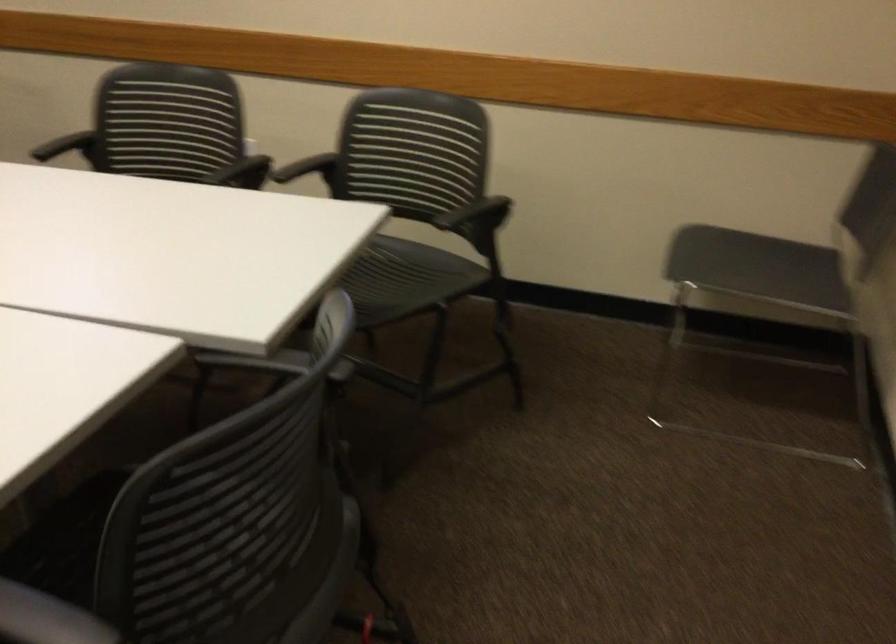
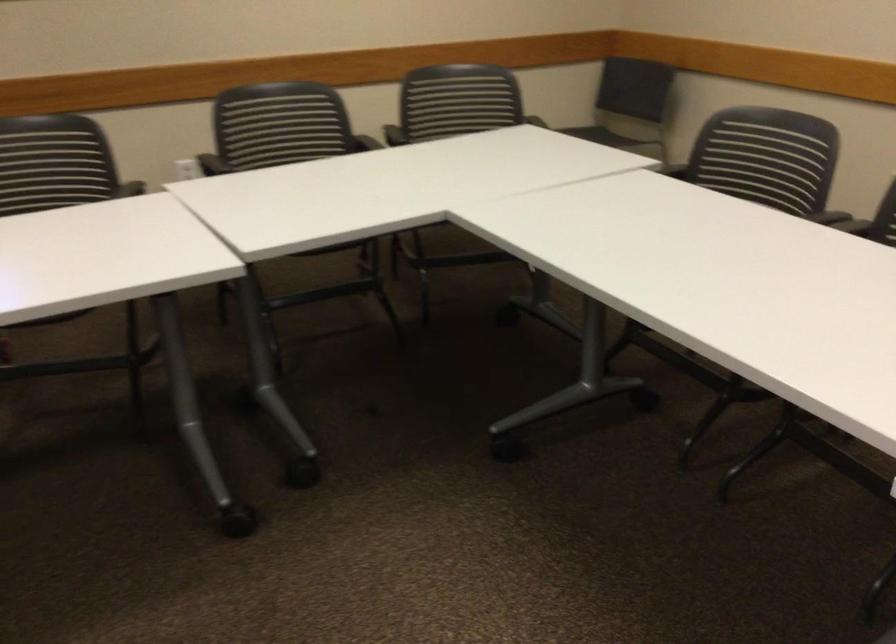
In the second image, find the point that corresponds to the point at 448,146 in the first image.

(455, 100)